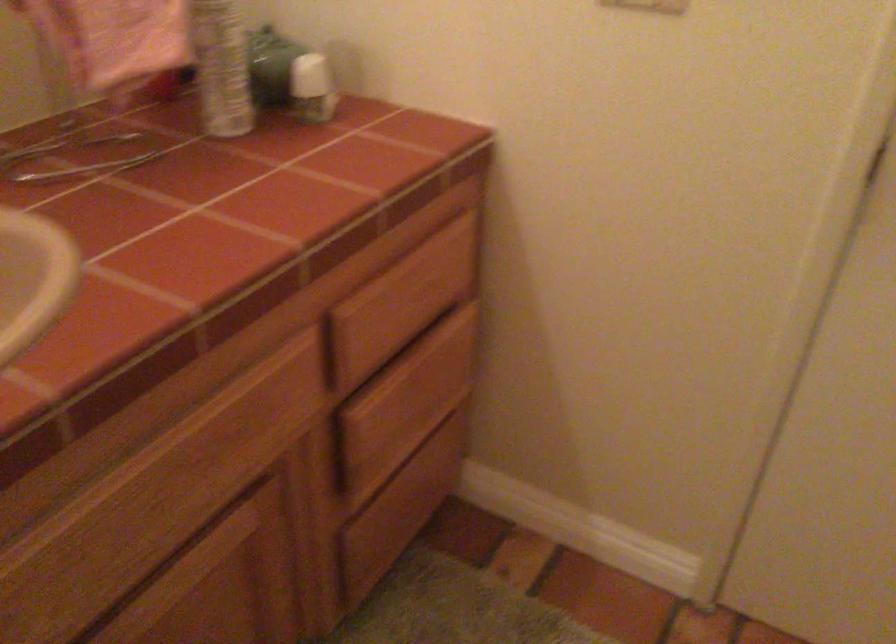
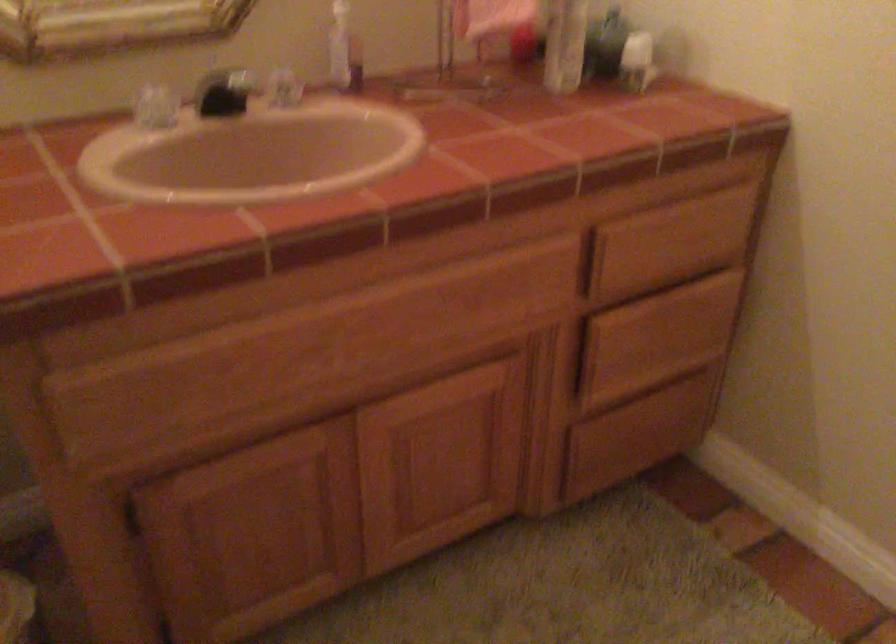
Locate, in the second image, the point that corresponds to the point at 409,305 in the first image.

(668, 243)